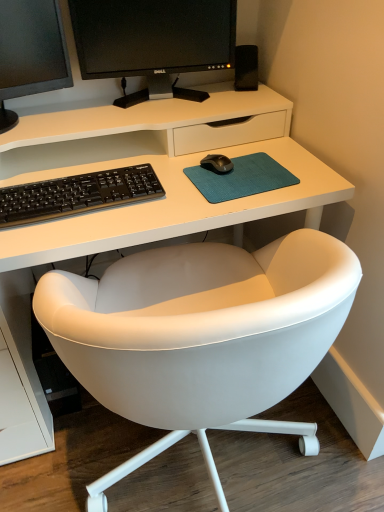
You are a GUI agent. You are given a task and a screenshot of the screen. Output one action in this format:
    pyautogui.click(x=<x>, y=<y>)
    Task: Click on the free location to the left of black matte speaker at upper right
    The image size is (384, 512).
    Given the screenshot: What is the action you would take?
    pyautogui.click(x=212, y=93)